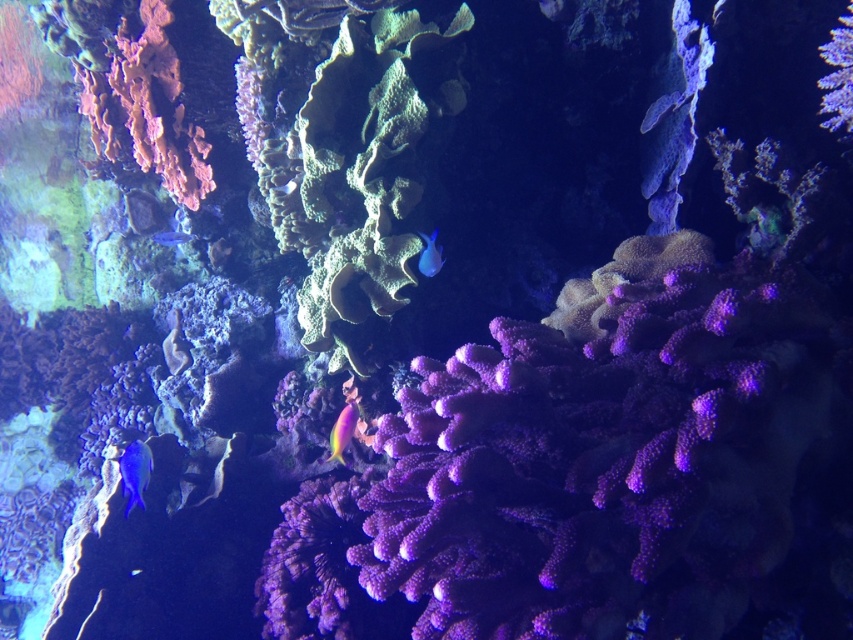
Question: Which point is closer to the camera?

Choices:
 (A) (173, 243)
 (B) (674, 109)
 (C) (136, 444)
 (D) (331, 444)

Answer: (D)

Question: In this image, where is matte blue fish at lower left located relative to blue glossy fish at left?

Choices:
 (A) above
 (B) below

Answer: (B)

Question: Considering the real-world distances, which object is farthest from the shiny blue fish at upper right?

Choices:
 (A) matte blue fish at lower left
 (B) shiny pink coral at center

Answer: (A)

Question: Estimate the real-world distances between objects in this image. Which object is farther from the shiny blue fish at upper right?

Choices:
 (A) blue glossy fish at left
 (B) shiny pink coral at center
 (C) blue glossy fish at center

Answer: (A)

Question: Does shiny pink coral at center have a smaller size compared to blue glossy fish at center?

Choices:
 (A) yes
 (B) no

Answer: (B)

Question: Does shiny blue fish at upper right have a larger size compared to blue glossy fish at center?

Choices:
 (A) yes
 (B) no

Answer: (B)